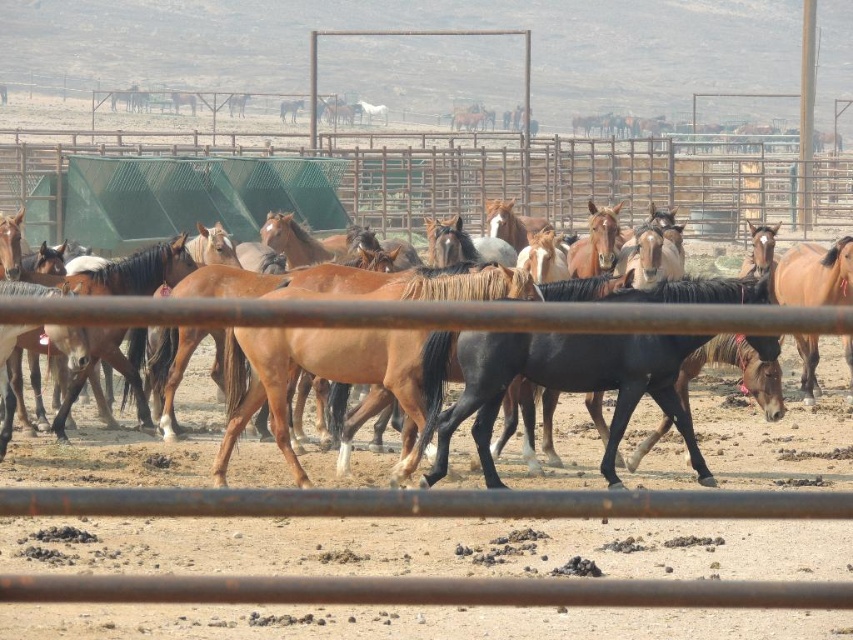
You are a farmer checking the fence height to ensure the horses can jump over it. Based on the scene, can the brown glossy horse at center jump over the green wire mesh fence at upper center?

The green wire mesh fence at upper center is taller than the brown glossy horse at center, so the horse may not be able to jump over it safely. Consider lowering the fence or using a different area for jumping practice.

You are a farmer standing near the green wire mesh fence at upper center and want to catch the brown glossy horse at center. Can you reach the horse without leaving the fence area?

The distance between the green wire mesh fence at upper center and the brown glossy horse at center is 86.68 feet, so you cannot reach the horse without leaving the fence area.

You are standing in the paddock and want to move from the point at coordinates point [541,154] to the point at coordinates point [83,304]. Which direction should you move in to get closer to the second point?

You should move downward and to the right because point [541,154] is further away from you than point [83,304], so moving towards the lower right direction will bring you closer.